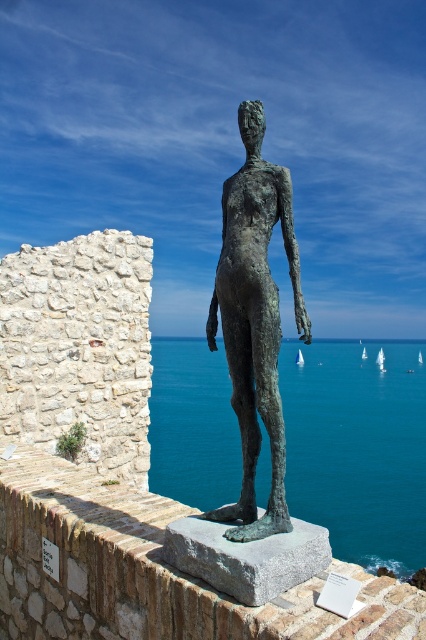
Question: Which object appears farthest from the camera in this image?

Choices:
 (A) brick stone ledge at center
 (B) blue water at center
 (C) bronze statue at center

Answer: (A)

Question: Which object is the closest to the brick stone ledge at center?

Choices:
 (A) blue water at center
 (B) bronze statue at center

Answer: (B)

Question: Where is blue water at center located in relation to brick stone ledge at center in the image?

Choices:
 (A) below
 (B) above

Answer: (A)

Question: In this image, where is brick stone ledge at center located relative to bronze statue at center?

Choices:
 (A) above
 (B) below

Answer: (B)

Question: Which of the following is the closest to the observer?

Choices:
 (A) (235, 291)
 (B) (140, 614)
 (C) (380, 550)

Answer: (A)

Question: Is blue water at center wider than bronze statue at center?

Choices:
 (A) yes
 (B) no

Answer: (A)